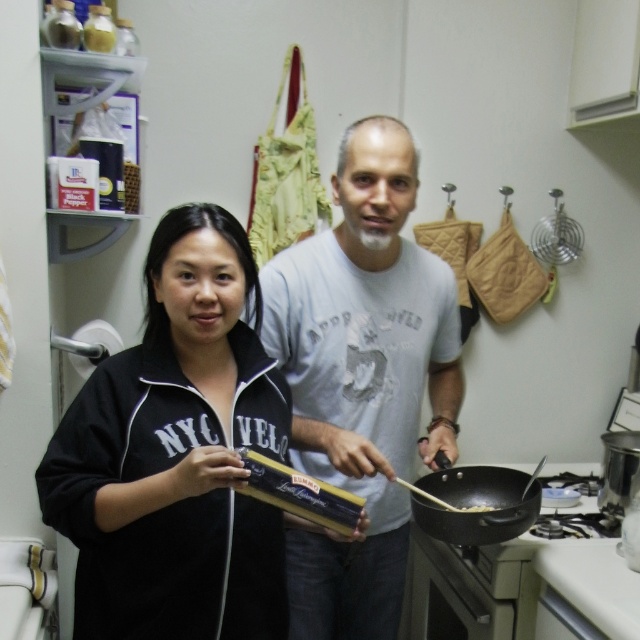
Is black matte jacket at center below brown crispy noodles at pan right?

No.

Is black matte jacket at center thinner than brown crispy noodles at pan right?

No.

What do you see at coordinates (177, 456) in the screenshot? This screenshot has width=640, height=640. I see `black matte jacket at center` at bounding box center [177, 456].

I want to click on black matte jacket at center, so click(x=177, y=456).

Between black matte jacket at center and black matte wok at center, which one has more height?

black matte jacket at center is taller.

Who is lower down, black matte jacket at center or black matte wok at center?

black matte wok at center

Is point (196, 403) positioned after point (484, 467)?

No, (196, 403) is closer to viewer.

The image size is (640, 640). Find the location of `black matte jacket at center`. black matte jacket at center is located at coordinates (177, 456).

Is white cotton shirt at center taller than black matte wok at center?

Correct, white cotton shirt at center is much taller as black matte wok at center.

Where is `white cotton shirt at center`? white cotton shirt at center is located at coordinates (362, 378).

Where is `white cotton shirt at center`? The height and width of the screenshot is (640, 640). white cotton shirt at center is located at coordinates (362, 378).